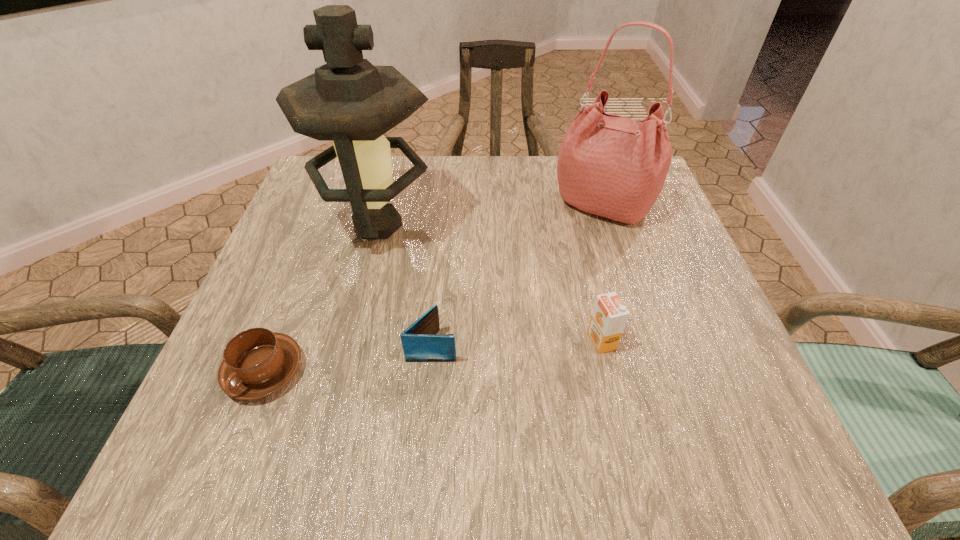
You are a GUI agent. You are given a task and a screenshot of the screen. Output one action in this format:
    pyautogui.click(x=<x>, y=<y>)
    Task: Click on the free spot between the orange juice and the wallet
    The image size is (960, 540).
    Given the screenshot: What is the action you would take?
    pyautogui.click(x=516, y=343)

In order to click on vacant space that's between the wallet and the cappuccino in this screenshot , I will do `click(348, 358)`.

The height and width of the screenshot is (540, 960). I want to click on free space between the third shortest object and the oil lamp, so click(x=490, y=283).

Image resolution: width=960 pixels, height=540 pixels. Identify the location of vacant area that lies between the wallet and the third shortest object. (516, 343).

Locate an element on the screen. The width and height of the screenshot is (960, 540). vacant space in between the oil lamp and the handbag is located at coordinates (491, 215).

Find the location of `free space that is in between the oil lamp and the handbag`. free space that is in between the oil lamp and the handbag is located at coordinates (491, 215).

You are a GUI agent. You are given a task and a screenshot of the screen. Output one action in this format:
    pyautogui.click(x=<x>, y=<y>)
    Task: Click on the empty space that is in between the wallet and the oil lamp
    Image resolution: width=960 pixels, height=540 pixels.
    Given the screenshot: What is the action you would take?
    pyautogui.click(x=405, y=285)

The width and height of the screenshot is (960, 540). What are the coordinates of `vacant space that is in between the orange juice and the handbag` in the screenshot? It's located at (602, 273).

Find the location of a particular element. vacant space in between the handbag and the cappuccino is located at coordinates (434, 288).

Select which object appears as the third closest to the orange juice. Please provide its 2D coordinates. Your answer should be formatted as a tuple, i.e. [(x, y)], where the tuple contains the x and y coordinates of a point satisfying the conditions above.

[(349, 101)]